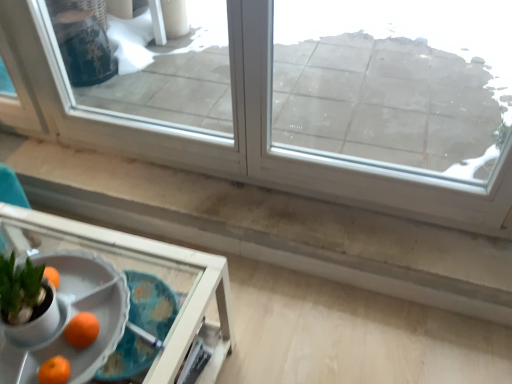
Question: Is the depth of white plastic tray at lower left greater than that of transparent glass window at upper center, the second window from the right?

Choices:
 (A) no
 (B) yes

Answer: (A)

Question: From the image's perspective, does white plastic tray at lower left appear lower than transparent glass window at upper center, the second window from the right?

Choices:
 (A) no
 (B) yes

Answer: (B)

Question: Is white plastic tray at lower left placed right next to transparent glass window at upper center, the 1th window positioned from the left?

Choices:
 (A) yes
 (B) no

Answer: (B)

Question: Is white plastic tray at lower left taller than transparent glass window at upper center, the second window from the right?

Choices:
 (A) no
 (B) yes

Answer: (A)

Question: Can we say white plastic tray at lower left lies outside transparent glass window at upper center, the second window from the right?

Choices:
 (A) yes
 (B) no

Answer: (A)

Question: Is white plastic tray at lower left shorter than transparent glass window at upper center, the second window from the right?

Choices:
 (A) no
 (B) yes

Answer: (B)

Question: From the image's perspective, does transparent glass window at upper center, the 1th window positioned from the left, appear higher than orange matte at lower left?

Choices:
 (A) no
 (B) yes

Answer: (B)

Question: Is transparent glass window at upper center, the second window from the right, touching orange matte at lower left?

Choices:
 (A) yes
 (B) no

Answer: (B)

Question: Is transparent glass window at upper center, the second window from the right, taller than orange matte at lower left?

Choices:
 (A) no
 (B) yes

Answer: (B)

Question: From a real-world perspective, is transparent glass window at upper center, the second window from the right, over orange matte at lower left?

Choices:
 (A) yes
 (B) no

Answer: (A)

Question: Does transparent glass window at upper center, the 1th window positioned from the left, have a greater width compared to orange matte at lower left?

Choices:
 (A) no
 (B) yes

Answer: (B)

Question: Is the position of transparent glass window at upper center, the second window from the right, less distant than that of orange matte at lower left?

Choices:
 (A) yes
 (B) no

Answer: (B)

Question: Is white plastic tray at lower left oriented away from transparent glass window at upper center, the second window positioned from the left?

Choices:
 (A) yes
 (B) no

Answer: (B)